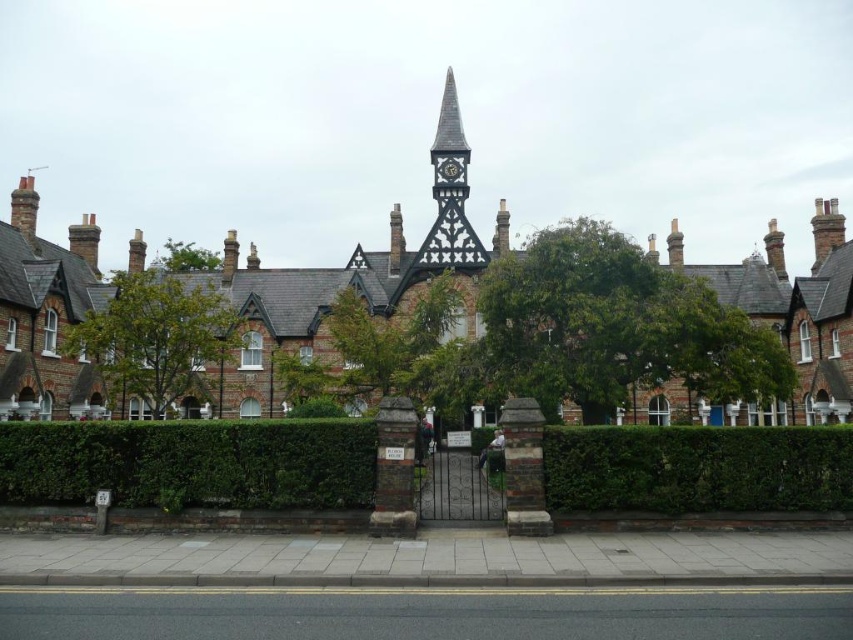
Who is positioned more to the right, green leafy tree at left or metallic clock at upper center?

From the viewer's perspective, metallic clock at upper center appears more on the right side.

Where is `green leafy tree at left`? This screenshot has height=640, width=853. green leafy tree at left is located at coordinates (155, 339).

The height and width of the screenshot is (640, 853). Describe the element at coordinates (155, 339) in the screenshot. I see `green leafy tree at left` at that location.

Identify the location of green leafy tree at left. Image resolution: width=853 pixels, height=640 pixels. [155, 339].

Is point (186, 358) positioned after point (177, 253)?

No, it is not.

Does green leafy tree at left have a greater height compared to green leafy tree at upper center?

Correct, green leafy tree at left is much taller as green leafy tree at upper center.

Image resolution: width=853 pixels, height=640 pixels. I want to click on green leafy tree at left, so click(x=155, y=339).

Is green leafy tree at upper center behind metallic clock at upper center?

Yes, it is behind metallic clock at upper center.

Is green leafy tree at upper center to the left of metallic clock at upper center from the viewer's perspective?

Correct, you'll find green leafy tree at upper center to the left of metallic clock at upper center.

The width and height of the screenshot is (853, 640). In order to click on green leafy tree at upper center in this screenshot , I will do `click(186, 257)`.